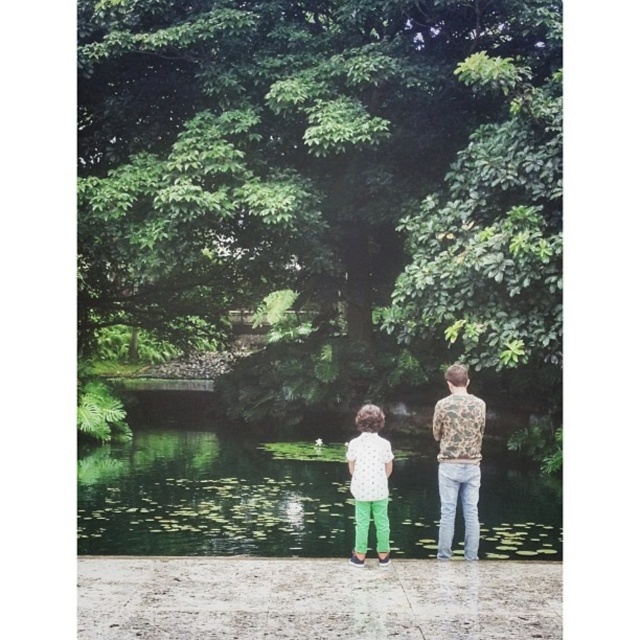
You are standing at the point where the two people are facing the water. There is a green lily pads at center located at point (212, 497). If you want to walk directly to the green lily pads at center, which direction should you move relative to the paved area?

The green lily pads at center is located at point (212, 497), so you should move forward towards the water to reach it.

You are standing at the point with coordinates point [458,460]. What object is directly below you?

The point [458,460] is on the camouflage patterned shirt at center, so the camouflage patterned shirt at center is directly below you.